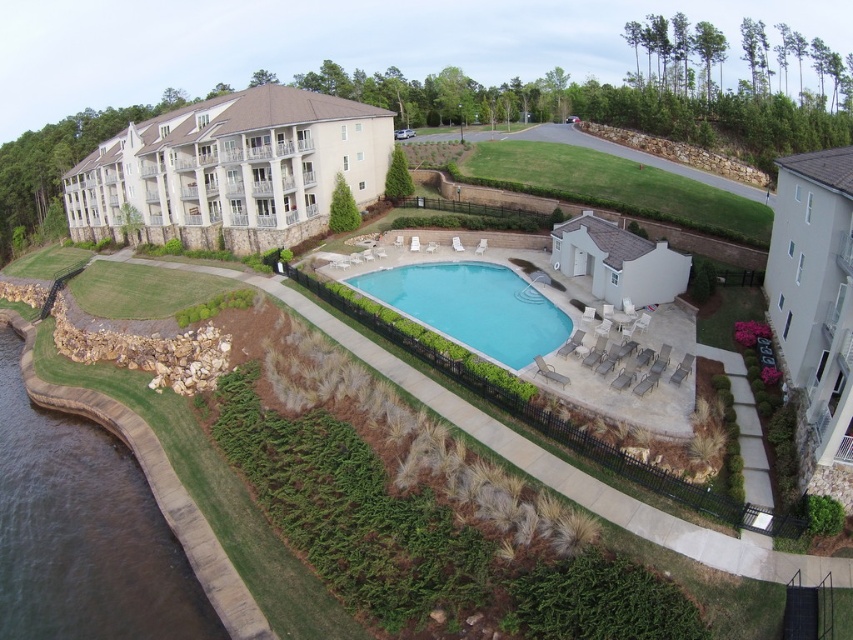
Question: From the image, what is the correct spatial relationship of dark brown concrete waterway at lower left in relation to clear blue water at center?

Choices:
 (A) below
 (B) above

Answer: (A)

Question: Which point appears closest to the camera in this image?

Choices:
 (A) (51, 621)
 (B) (427, 285)

Answer: (A)

Question: Can you confirm if dark brown concrete waterway at lower left is positioned above clear blue water at center?

Choices:
 (A) yes
 (B) no

Answer: (B)

Question: Can you confirm if dark brown concrete waterway at lower left is positioned below clear blue water at center?

Choices:
 (A) no
 (B) yes

Answer: (B)

Question: Which of the following is the closest to the observer?

Choices:
 (A) pos(456,340)
 (B) pos(195,589)

Answer: (B)